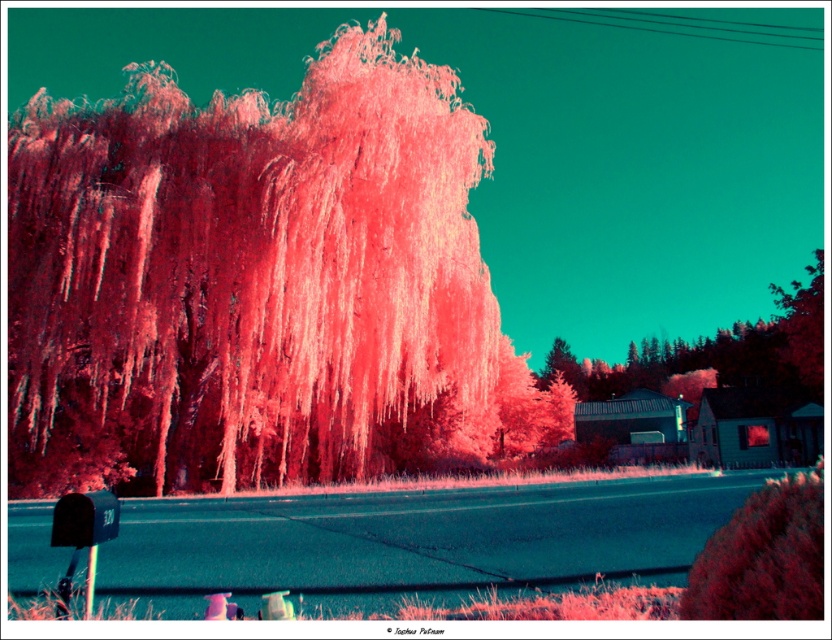
Who is positioned more to the left, pink matte tree at center or smooth red tree at lower right?

pink matte tree at center

Between pink matte tree at center and smooth red tree at lower right, which one is positioned lower?

smooth red tree at lower right is lower down.

Is point (192, 456) positioned before point (821, 545)?

That is False.

At what (x,y) coordinates should I click in order to perform the action: click on pink matte tree at center. Please return your answer as a coordinate pair (x, y). This screenshot has width=832, height=640. Looking at the image, I should click on (258, 284).